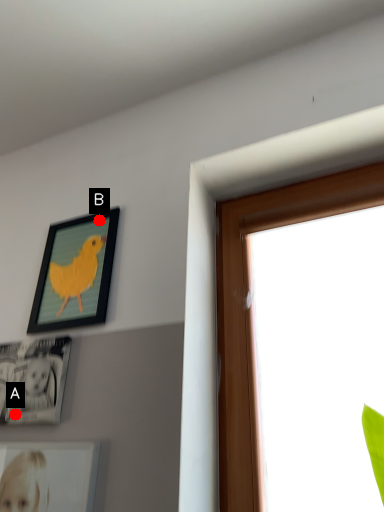
Question: Two points are circled on the image, labeled by A and B beside each circle. Which of the following is the farthest from the observer?

Choices:
 (A) A is further
 (B) B is further

Answer: (B)